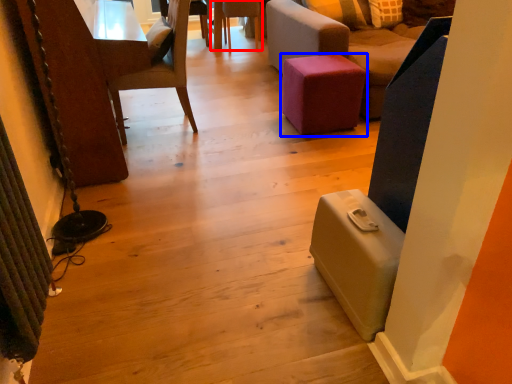
Question: Which point is further to the camera, chair (highlighted by a red box) or furniture (highlighted by a blue box)?

Choices:
 (A) chair
 (B) furniture

Answer: (A)